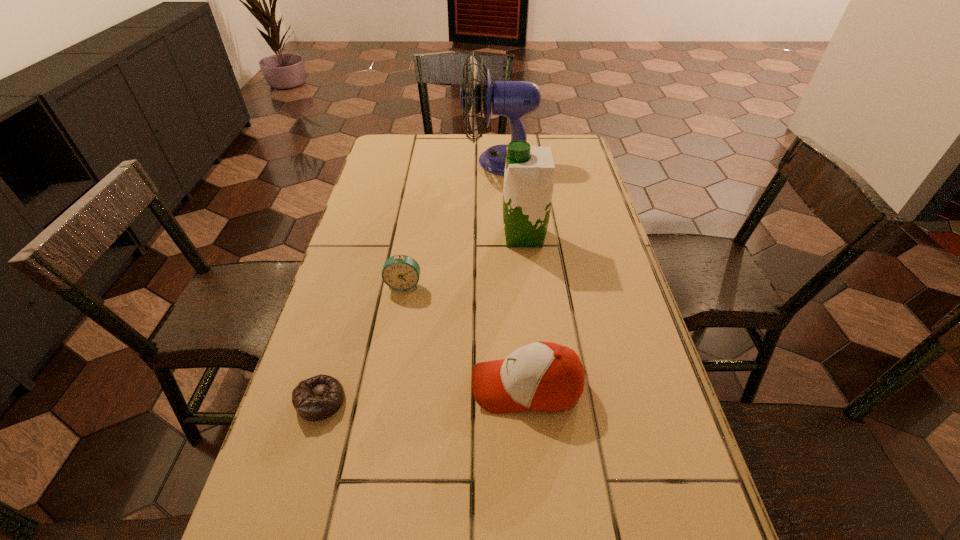
At what (x,y) coordinates should I click in order to perform the action: click on the tallest object. Please return your answer as a coordinate pair (x, y). Looking at the image, I should click on (514, 99).

This screenshot has height=540, width=960. In order to click on the farthest object in this screenshot , I will do `click(514, 99)`.

This screenshot has height=540, width=960. Find the location of `the second farthest object`. the second farthest object is located at coordinates point(529,173).

This screenshot has height=540, width=960. I want to click on the fourth shortest object, so click(x=529, y=173).

Identify the location of baseball cap. The height and width of the screenshot is (540, 960). (547, 377).

Find the location of `alarm clock`. alarm clock is located at coordinates (400, 272).

Find the location of a particular element. The width and height of the screenshot is (960, 540). the fourth tallest object is located at coordinates (400, 272).

Identify the location of the shortest object. (317, 398).

The height and width of the screenshot is (540, 960). I want to click on the leftmost object, so click(317, 398).

What are the coordinates of `blank space located in front of the farthest object where the airflow is directed` in the screenshot? It's located at (392, 161).